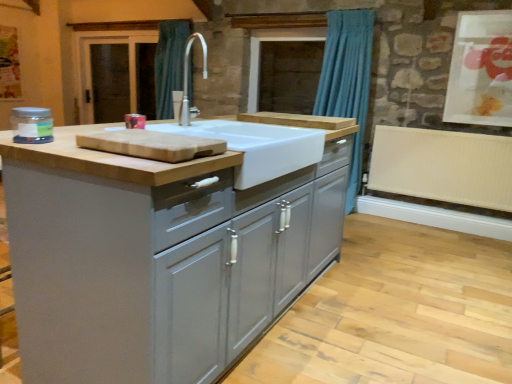
Image resolution: width=512 pixels, height=384 pixels. I want to click on vacant point above matte paper artwork at upper right (from a real-world perspective), so click(488, 9).